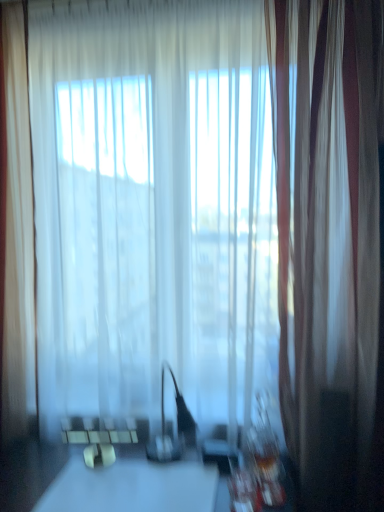
Question: Choose the correct answer: Is translucent white curtain at left, the first curtain positioned from the left, inside white glossy table at center or outside it?

Choices:
 (A) outside
 (B) inside

Answer: (A)

Question: Relative to white glossy table at center, is translucent white curtain at left, the first curtain positioned from the left, in front or behind?

Choices:
 (A) behind
 (B) front

Answer: (A)

Question: Which of these objects is positioned farthest from the translucent white curtain at left, the first curtain positioned from the left?

Choices:
 (A) white glossy table at center
 (B) silky white curtain at right, the first curtain in the right-to-left sequence
 (C) transparent fabric at center

Answer: (B)

Question: Which object is the closest to the silky white curtain at right, the second curtain in the left-to-right sequence?

Choices:
 (A) translucent white curtain at left, arranged as the second curtain when viewed from the right
 (B) transparent fabric at center
 (C) white glossy table at center

Answer: (B)